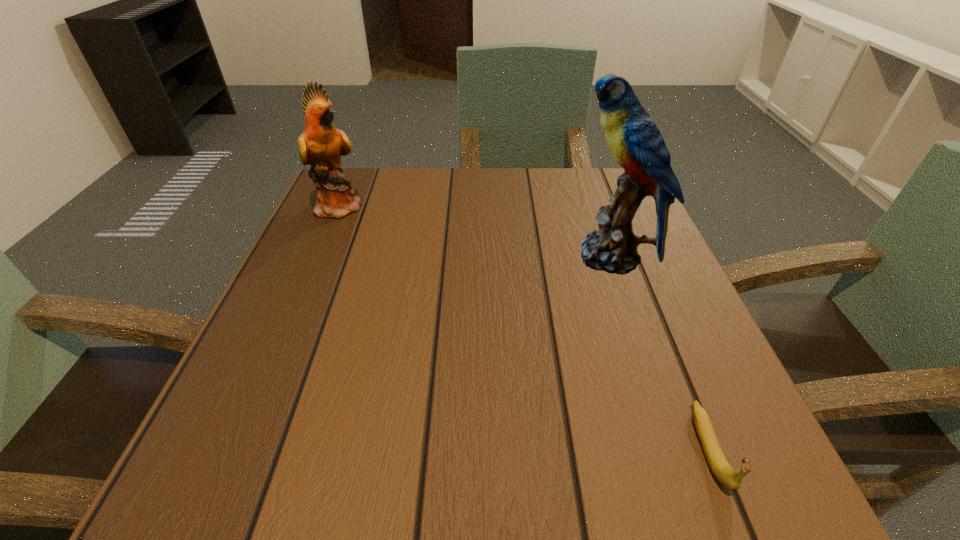
Identify the location of vacant space at the right edge of the desktop. The width and height of the screenshot is (960, 540). (599, 308).

Where is `free space at the far left corner of the desktop`? Image resolution: width=960 pixels, height=540 pixels. free space at the far left corner of the desktop is located at coordinates (361, 183).

In the image, there is a desktop. Where is `vacant space at the far right corner`? vacant space at the far right corner is located at coordinates (589, 183).

Locate an element on the screen. The width and height of the screenshot is (960, 540). free space at the near right corner of the desktop is located at coordinates (665, 479).

Locate an element on the screen. Image resolution: width=960 pixels, height=540 pixels. free space between the nearer parrot and the farther parrot is located at coordinates (475, 232).

In order to click on free point between the nearer parrot and the shortest object in this screenshot , I will do `click(660, 353)`.

Locate an element on the screen. The height and width of the screenshot is (540, 960). free space between the shortest object and the tallest object is located at coordinates (660, 353).

The height and width of the screenshot is (540, 960). I want to click on free space between the shorter parrot and the tallest object, so click(475, 232).

Locate an element on the screen. The height and width of the screenshot is (540, 960). unoccupied area between the shortest object and the second shortest object is located at coordinates (525, 328).

Where is `blank region between the tallest object and the farthest object`? The height and width of the screenshot is (540, 960). blank region between the tallest object and the farthest object is located at coordinates (475, 232).